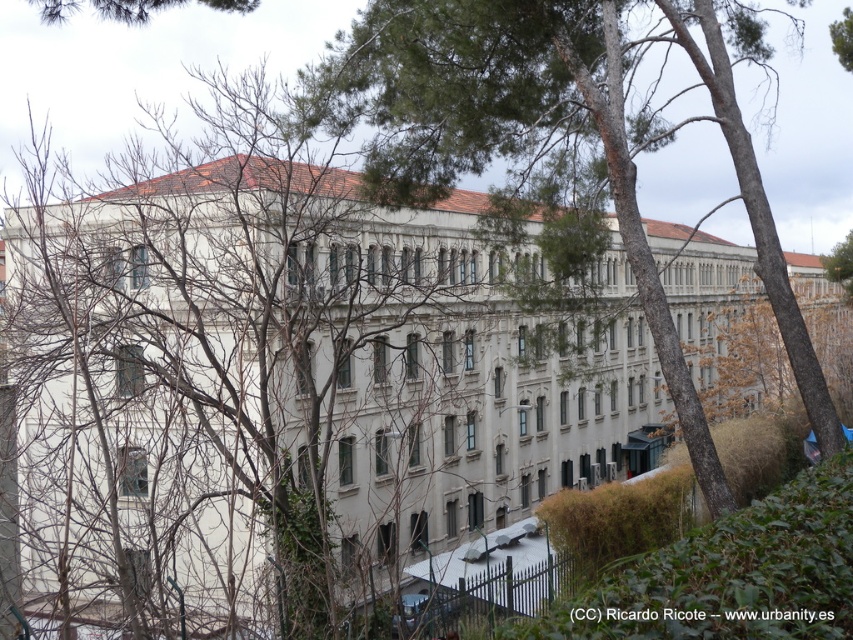
Who is more forward, (97, 13) or (843, 10)?

Point (97, 13)

Between green leafy tree at upper left and green leafy tree at upper right, which one has less height?

green leafy tree at upper right

Where is `green leafy tree at upper left`? The width and height of the screenshot is (853, 640). green leafy tree at upper left is located at coordinates (103, 8).

Which of these two, bare branches at center or green leafy tree at upper left, stands shorter?

green leafy tree at upper left is shorter.

Who is lower down, bare branches at center or green leafy tree at upper left?

Positioned lower is bare branches at center.

Who is more forward, (440, 356) or (154, 3)?

Point (154, 3) is more forward.

Locate an element on the screen. This screenshot has height=640, width=853. bare branches at center is located at coordinates (250, 384).

Consider the image. Measure the distance between bare branches at center and green leafy tree at upper right.

A distance of 27.19 meters exists between bare branches at center and green leafy tree at upper right.

Between bare branches at center and green leafy tree at upper right, which one is positioned higher?

green leafy tree at upper right is above.

Who is more distant from viewer, (503, 460) or (839, 54)?

The point (503, 460) is more distant.

Locate an element on the screen. bare branches at center is located at coordinates (250, 384).